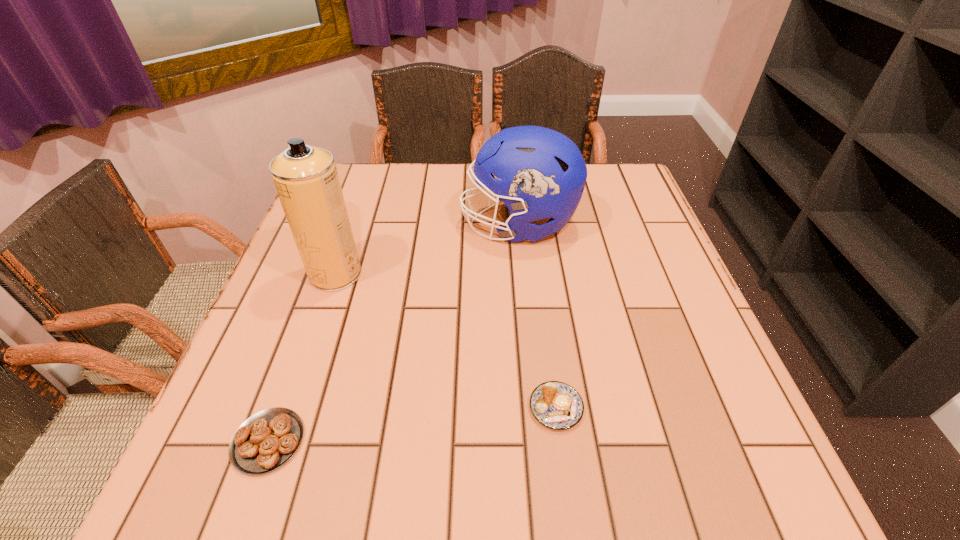
Locate an element on the screen. The width and height of the screenshot is (960, 540). free space at the right edge is located at coordinates (642, 354).

Image resolution: width=960 pixels, height=540 pixels. What are the coordinates of `vacant space at the far left corner of the desktop` in the screenshot? It's located at (343, 166).

Find the location of a particular element. The width and height of the screenshot is (960, 540). free space at the far right corner of the desktop is located at coordinates (612, 165).

I want to click on free space between the third nearest object and the farthest object, so click(427, 249).

Where is `vacant point located between the right pastry and the football helmet`? The width and height of the screenshot is (960, 540). vacant point located between the right pastry and the football helmet is located at coordinates (538, 316).

Identify the location of free spot between the left pastry and the second farthest object. Image resolution: width=960 pixels, height=540 pixels. (301, 357).

I want to click on free space between the right pastry and the third shortest object, so click(x=538, y=316).

Image resolution: width=960 pixels, height=540 pixels. In order to click on free space between the farthest object and the right pastry in this screenshot , I will do `click(538, 316)`.

At what (x,y) coordinates should I click in order to perform the action: click on free space between the left pastry and the right pastry. Please return your answer as a coordinate pair (x, y). The height and width of the screenshot is (540, 960). Looking at the image, I should click on (412, 424).

This screenshot has height=540, width=960. Identify the location of free space that is in between the right pastry and the left pastry. (412, 424).